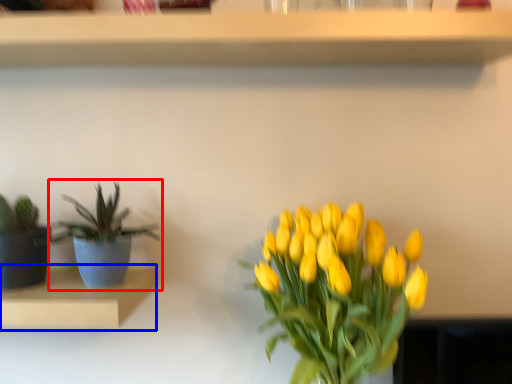
Question: Which of the following is the closest to the observer, houseplant (highlighted by a red box) or shelf (highlighted by a blue box)?

Choices:
 (A) houseplant
 (B) shelf

Answer: (B)